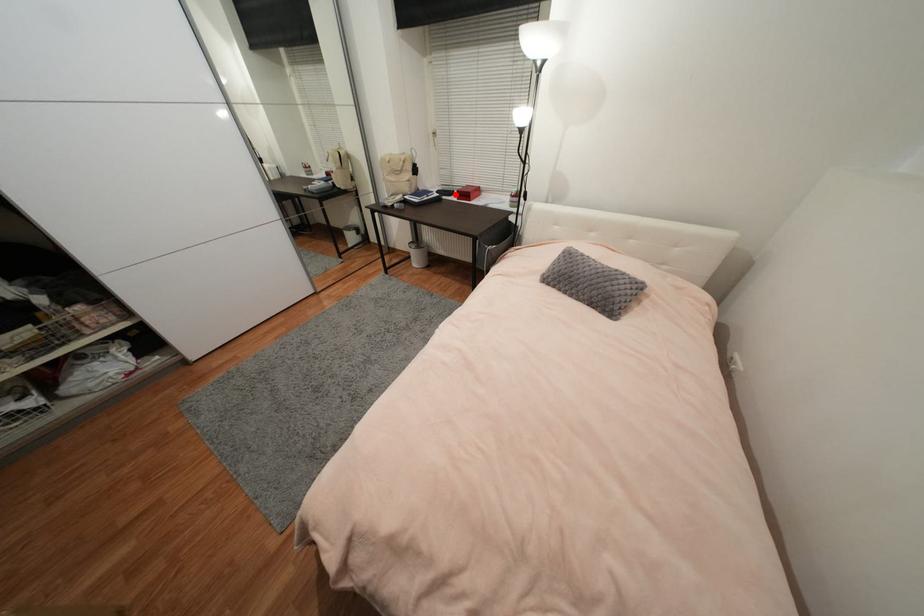
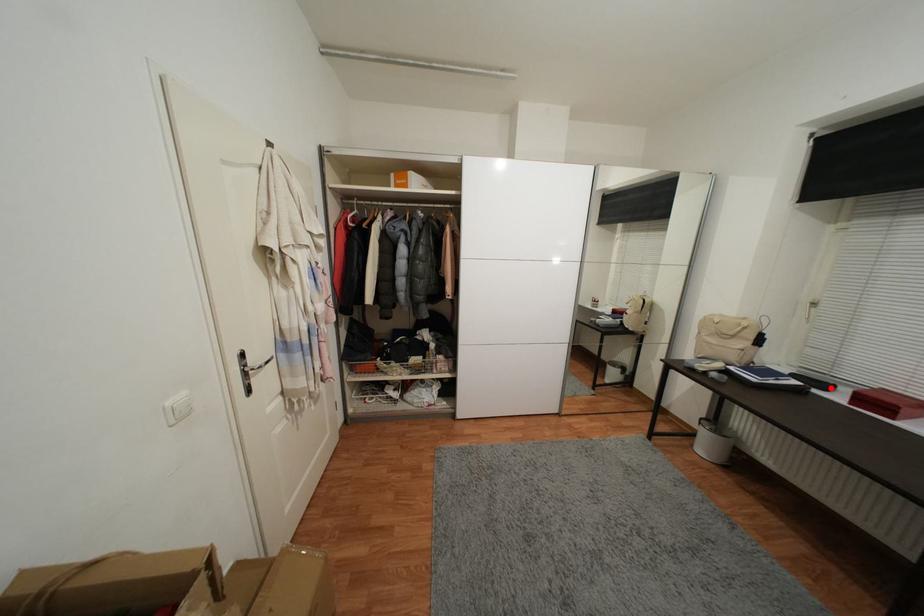
I am providing you with two images of the same scene from different viewpoints. A red point is marked on the first image and another point is marked on the second image. Does the point marked in image1 correspond to the same location as the one in image2?

Yes